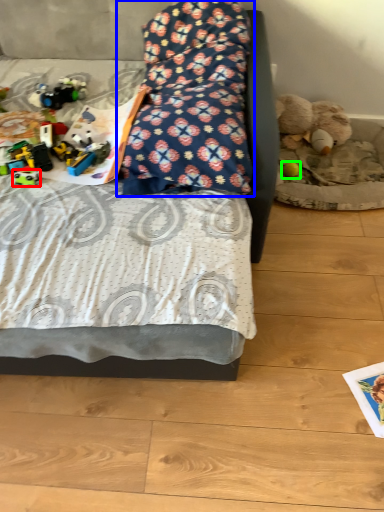
Question: Based on their relative distances, which object is farther from toy (highlighted by a red box)? Choose from pillow (highlighted by a blue box) and toy (highlighted by a green box).

Choices:
 (A) pillow
 (B) toy

Answer: (B)